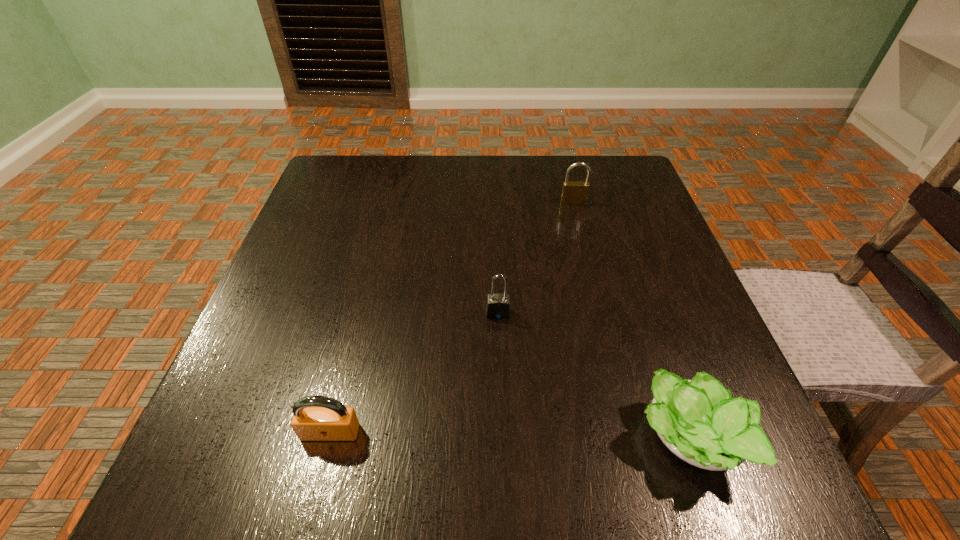
Where is `the farthest object`? The width and height of the screenshot is (960, 540). the farthest object is located at coordinates (573, 192).

Locate an element on the screen. Image resolution: width=960 pixels, height=540 pixels. the rightmost padlock is located at coordinates (573, 192).

What are the coordinates of `the second farthest padlock` in the screenshot? It's located at (498, 305).

This screenshot has height=540, width=960. Find the location of `the third nearest object`. the third nearest object is located at coordinates (498, 305).

The width and height of the screenshot is (960, 540). I want to click on the nearest padlock, so click(315, 418).

Identify the location of the leftmost padlock. This screenshot has width=960, height=540. (315, 418).

Where is `lettuce`? lettuce is located at coordinates (699, 422).

Find the location of a particular element. The image size is (960, 540). vacant space situated on the front-facing side of the rightmost padlock is located at coordinates (593, 281).

Locate an element on the screen. Image resolution: width=960 pixels, height=540 pixels. vacant area situated on the shackle of the second padlock from left to right is located at coordinates (505, 495).

Locate an element on the screen. free space located 0.080m on the back of the shortest object is located at coordinates (659, 353).